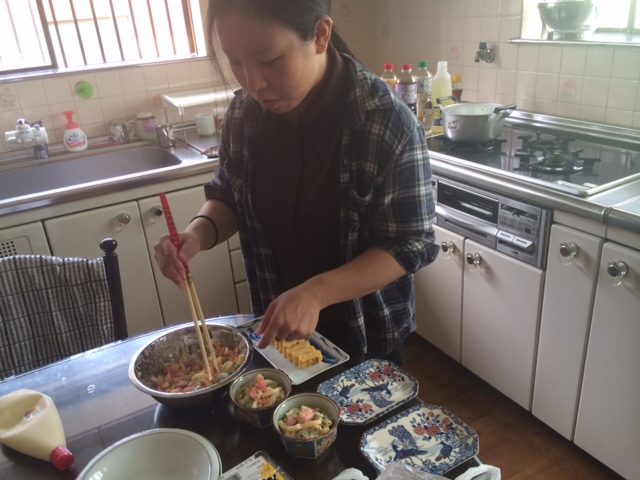
This screenshot has height=480, width=640. Find the location of `stove top`. stove top is located at coordinates (508, 155).